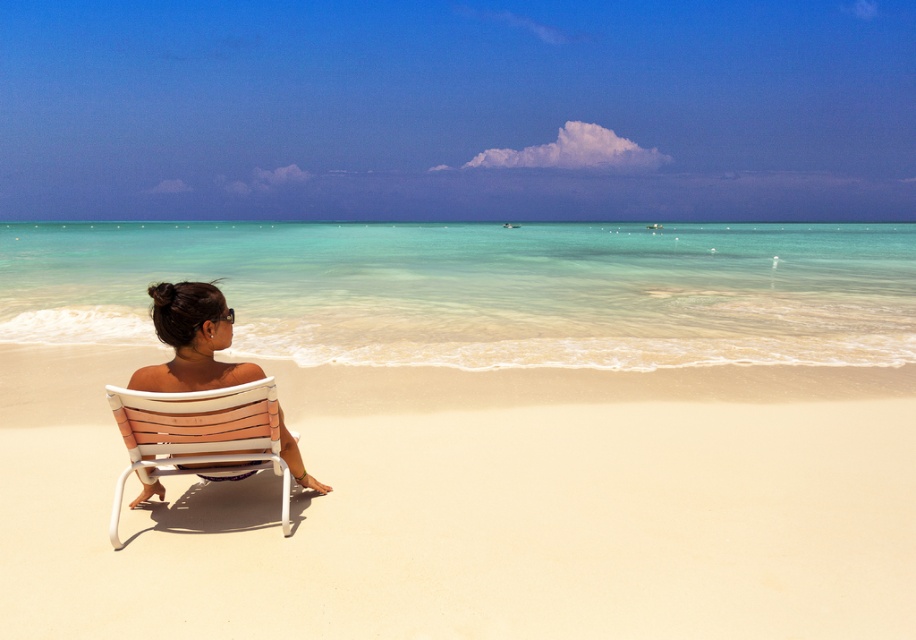
You are a photographer planning to capture a sunset shot. You have a matte white chair at center and beige sand at center in your frame. Which object should you adjust to ensure the chair is centered in the photo?

The beige sand at center is on the right side of the matte white chair at center, so you should move the beige sand at center to the left to center the matte white chair at center in the photo.